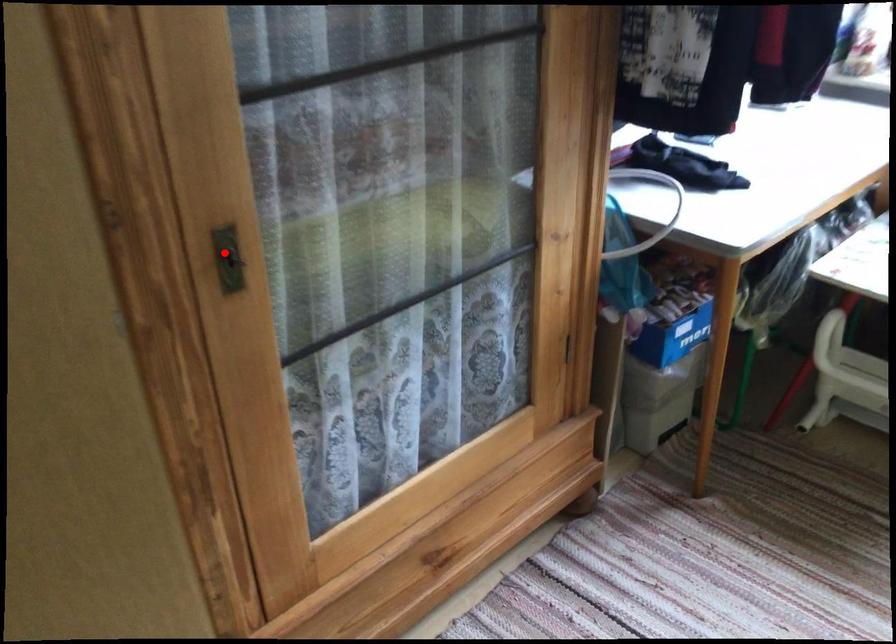
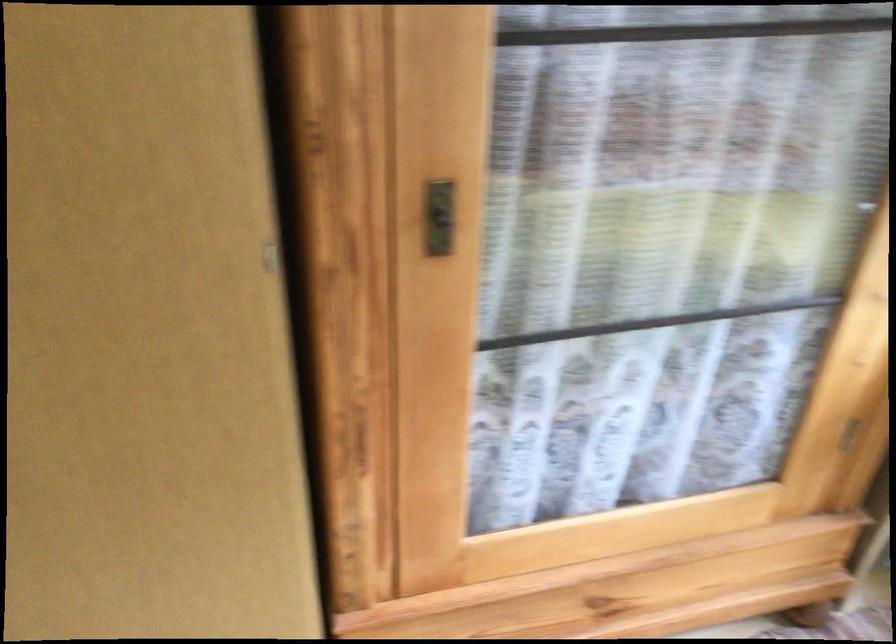
The point at the highlighted location is marked in the first image. Where is the corresponding point in the second image?

(438, 218)